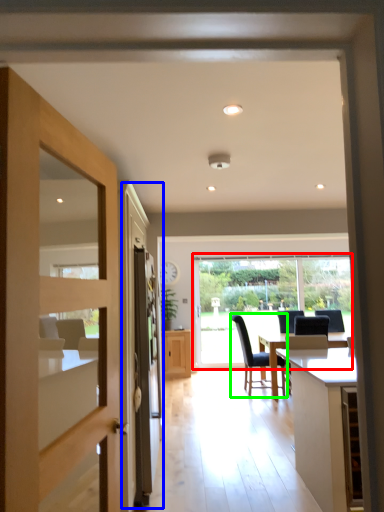
Question: Which is nearer to the window (highlighted by a red box)? screen door (highlighted by a blue box) or chair (highlighted by a green box).

Choices:
 (A) screen door
 (B) chair

Answer: (B)